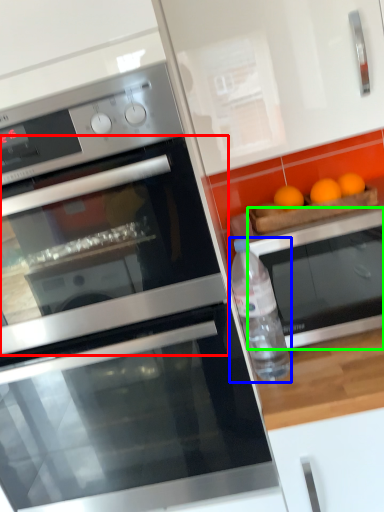
Question: Estimate the real-world distances between objects in this image. Which object is farther from oven (highlighted by a red box), bottle (highlighted by a blue box) or oven (highlighted by a green box)?

Choices:
 (A) bottle
 (B) oven

Answer: (B)